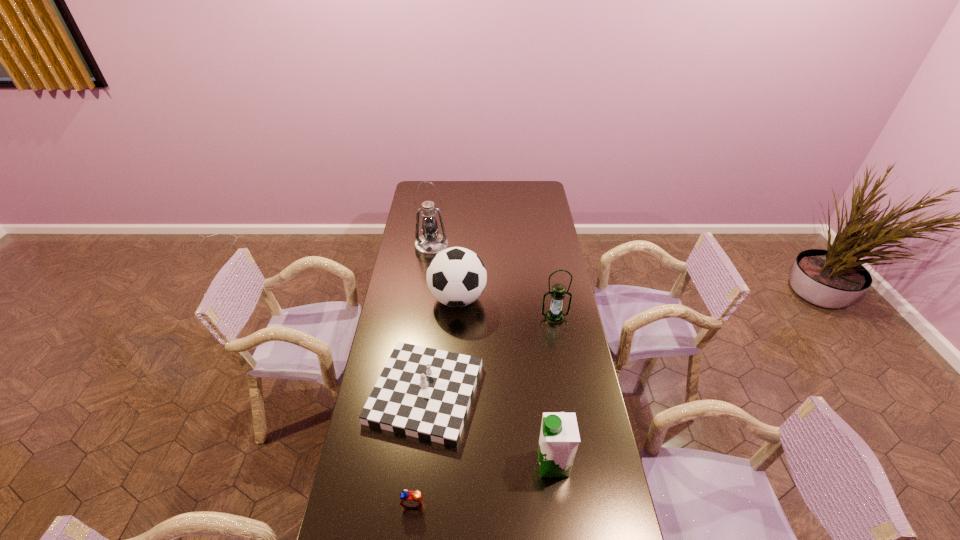
This screenshot has height=540, width=960. What are the coordinates of `the tallest object` in the screenshot? It's located at (430, 243).

What are the coordinates of `the farthest object` in the screenshot? It's located at (430, 243).

Where is `lantern`? lantern is located at coordinates (554, 316).

At what (x,y) coordinates should I click in order to perform the action: click on soccer ball. Please return your answer as a coordinate pair (x, y). Looking at the image, I should click on [456, 277].

Where is `the fifth farthest object`? The image size is (960, 540). the fifth farthest object is located at coordinates (559, 437).

Identify the location of the fourth farthest object. (422, 392).

Find the location of a particular element. The image size is (960, 540). the second shortest object is located at coordinates (422, 392).

Locate an element on the screen. Image resolution: width=960 pixels, height=540 pixels. the shortest object is located at coordinates (411, 499).

This screenshot has height=540, width=960. I want to click on the nearest object, so click(x=411, y=499).

In order to click on free space located on the left of the tallest object in this screenshot , I will do `click(399, 248)`.